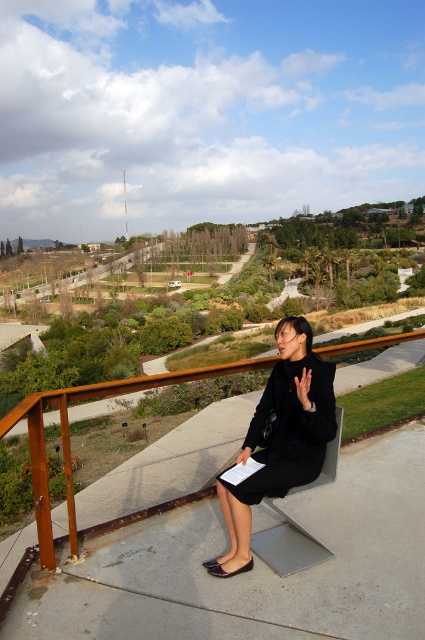
Can you confirm if black matte dress at center is positioned below brown wooden rail at upper center?

Indeed, black matte dress at center is positioned under brown wooden rail at upper center.

Which of these two, black matte dress at center or brown wooden rail at upper center, stands taller?

Standing taller between the two is brown wooden rail at upper center.

What do you see at coordinates (280, 438) in the screenshot? This screenshot has height=640, width=425. I see `black matte dress at center` at bounding box center [280, 438].

I want to click on black matte dress at center, so tap(280, 438).